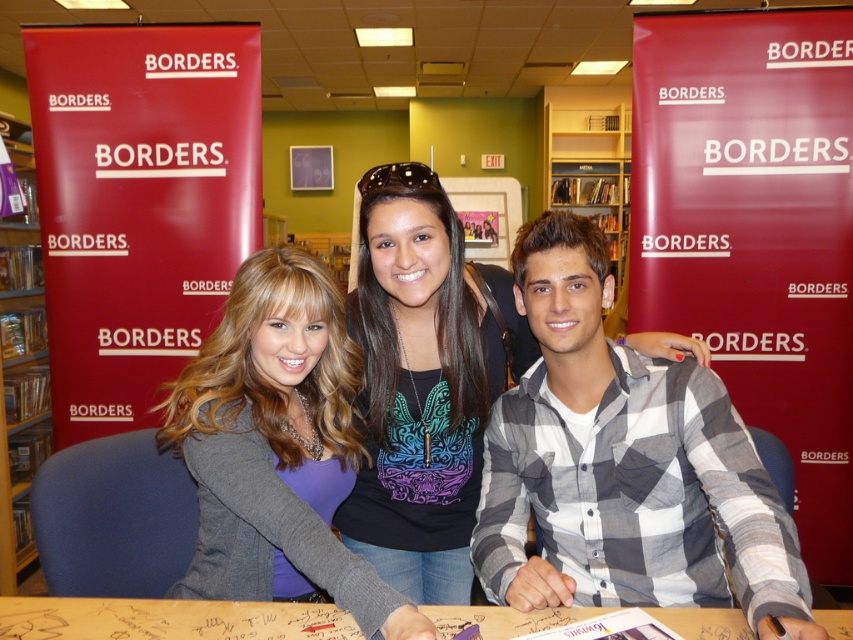
What do you see at coordinates (624, 465) in the screenshot? I see `gray checkered shirt at center` at bounding box center [624, 465].

Who is positioned more to the right, gray checkered shirt at center or wooden table at center?

gray checkered shirt at center is more to the right.

Between point (579, 324) and point (131, 634), which one is positioned behind?

Point (579, 324)

This screenshot has height=640, width=853. In order to click on gray checkered shirt at center in this screenshot , I will do `click(624, 465)`.

Does gray checkered shirt at center have a larger size compared to wooden bookshelf at center?

No, gray checkered shirt at center is not bigger than wooden bookshelf at center.

Image resolution: width=853 pixels, height=640 pixels. Identify the location of gray checkered shirt at center. (624, 465).

Who is positioned more to the right, gray checkered shirt at center or black matte shirt at center?

gray checkered shirt at center

Is point (509, 520) closer to viewer compared to point (399, 481)?

That is True.

Is point (718, 472) positioned after point (473, 483)?

No, (718, 472) is closer to viewer.

You are a GUI agent. You are given a task and a screenshot of the screen. Output one action in this format:
    pyautogui.click(x=<x>, y=<y>)
    Task: Click on the gray checkered shirt at center
    
    Given the screenshot: What is the action you would take?
    pyautogui.click(x=624, y=465)